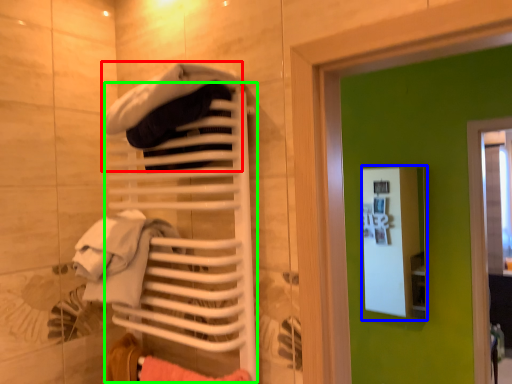
Question: Estimate the real-world distances between objects in this image. Which object is closer to clothing (highlighted by a red box), medicine cabinet (highlighted by a blue box) or closet (highlighted by a green box)?

Choices:
 (A) medicine cabinet
 (B) closet

Answer: (B)